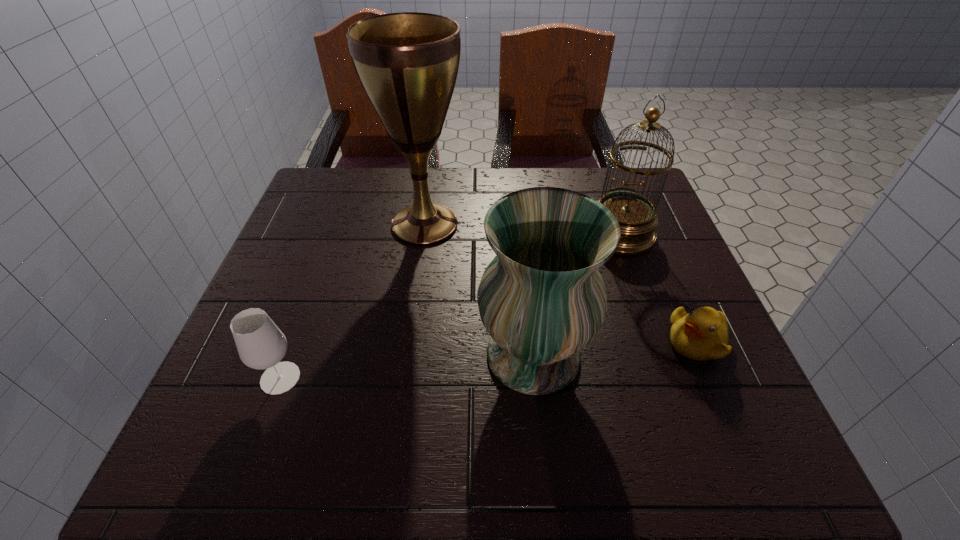
Locate an element on the screen. The height and width of the screenshot is (540, 960). trophy cup is located at coordinates (407, 63).

Where is `the second object from left to right`? the second object from left to right is located at coordinates (407, 63).

Where is `birdcage`? This screenshot has height=540, width=960. birdcage is located at coordinates (637, 216).

The image size is (960, 540). I want to click on the third object from left to right, so click(x=542, y=299).

At what (x,y) coordinates should I click in order to perform the action: click on the leftmost object. Please return your answer as a coordinate pair (x, y). This screenshot has width=960, height=540. Looking at the image, I should click on (261, 345).

The image size is (960, 540). I want to click on the second shortest object, so click(x=261, y=345).

Where is `the shortest object`? This screenshot has width=960, height=540. the shortest object is located at coordinates (701, 335).

Locate an element on the screen. The width and height of the screenshot is (960, 540). vacant space located 0.060m on the front of the trophy cup is located at coordinates (419, 271).

Identify the location of free space located with an open door on the birdcage. (657, 340).

This screenshot has height=540, width=960. Identify the location of vacant region located on the left of the vase. (346, 355).